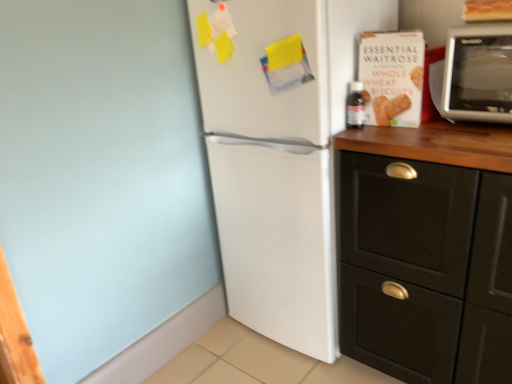
Question: Does white cardboard box of whole wheat biscuits at upper right have a larger size compared to white matte refrigerator at center?

Choices:
 (A) yes
 (B) no

Answer: (B)

Question: From the image's perspective, would you say white cardboard box of whole wheat biscuits at upper right is positioned over white matte refrigerator at center?

Choices:
 (A) no
 (B) yes

Answer: (B)

Question: Does white cardboard box of whole wheat biscuits at upper right have a lesser height compared to white matte refrigerator at center?

Choices:
 (A) no
 (B) yes

Answer: (B)

Question: Considering the relative sizes of white cardboard box of whole wheat biscuits at upper right and white matte refrigerator at center in the image provided, is white cardboard box of whole wheat biscuits at upper right smaller than white matte refrigerator at center?

Choices:
 (A) no
 (B) yes

Answer: (B)

Question: From a real-world perspective, is white cardboard box of whole wheat biscuits at upper right positioned under white matte refrigerator at center based on gravity?

Choices:
 (A) yes
 (B) no

Answer: (B)

Question: From the image's perspective, is silver metallic microwave at upper right positioned above or below white matte refrigerator at center?

Choices:
 (A) below
 (B) above

Answer: (B)

Question: From their relative heights in the image, would you say silver metallic microwave at upper right is taller or shorter than white matte refrigerator at center?

Choices:
 (A) short
 (B) tall

Answer: (A)

Question: Considering the positions of silver metallic microwave at upper right and white matte refrigerator at center in the image, is silver metallic microwave at upper right wider or thinner than white matte refrigerator at center?

Choices:
 (A) thin
 (B) wide

Answer: (A)

Question: Choose the correct answer: Is silver metallic microwave at upper right inside white matte refrigerator at center or outside it?

Choices:
 (A) inside
 (B) outside

Answer: (B)

Question: From a real-world perspective, is white matte refrigerator at center physically located above or below silver metallic microwave at upper right?

Choices:
 (A) below
 (B) above

Answer: (A)

Question: Relative to silver metallic microwave at upper right, is white matte refrigerator at center in front or behind?

Choices:
 (A) behind
 (B) front

Answer: (A)

Question: In terms of size, does white matte refrigerator at center appear bigger or smaller than silver metallic microwave at upper right?

Choices:
 (A) small
 (B) big

Answer: (B)

Question: Is white matte refrigerator at center situated inside silver metallic microwave at upper right or outside?

Choices:
 (A) inside
 (B) outside

Answer: (B)

Question: In terms of size, does black matte cabinet at right appear bigger or smaller than silver metallic microwave at upper right?

Choices:
 (A) big
 (B) small

Answer: (A)

Question: Considering their positions, is black matte cabinet at right located in front of or behind silver metallic microwave at upper right?

Choices:
 (A) front
 (B) behind

Answer: (A)